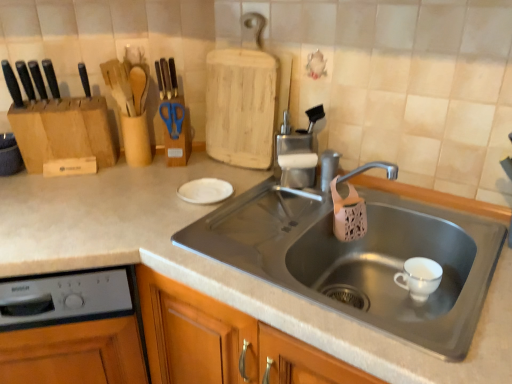
Where is `unoccupied area behind black matte knife at left, the first knife positioned from the left`? This screenshot has height=384, width=512. unoccupied area behind black matte knife at left, the first knife positioned from the left is located at coordinates (49, 100).